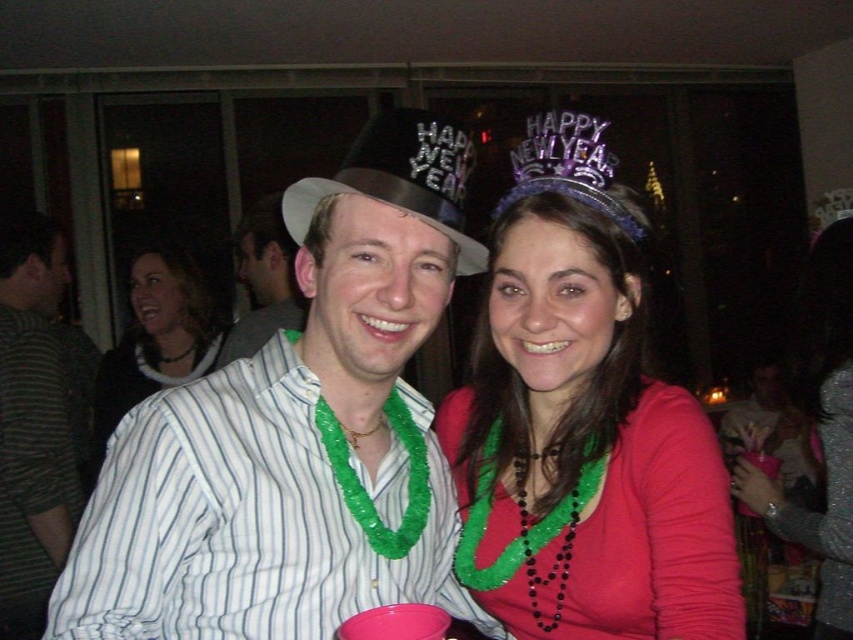
Question: Can you confirm if striped cotton shirt at center is wider than purple glittery tiara at upper center?

Choices:
 (A) yes
 (B) no

Answer: (A)

Question: From the image, what is the correct spatial relationship of striped cotton shirt at center in relation to matte black necklace at upper left?

Choices:
 (A) right
 (B) left

Answer: (A)

Question: Which object appears closest to the camera in this image?

Choices:
 (A) green beaded necklace at center
 (B) matte black necklace at upper left
 (C) pink matte shirt at center

Answer: (C)

Question: Among these points, which one is nearest to the camera?

Choices:
 (A) (550, 627)
 (B) (361, 436)
 (C) (537, 193)

Answer: (B)

Question: Which of the following is the farthest from the observer?

Choices:
 (A) green beaded necklace at center
 (B) striped cotton shirt at center
 (C) brown felt cowboy hat at center
 (D) purple glittery tiara at upper center

Answer: (D)

Question: Is striped shirt at left in front of purple glittery tiara at upper center?

Choices:
 (A) no
 (B) yes

Answer: (A)